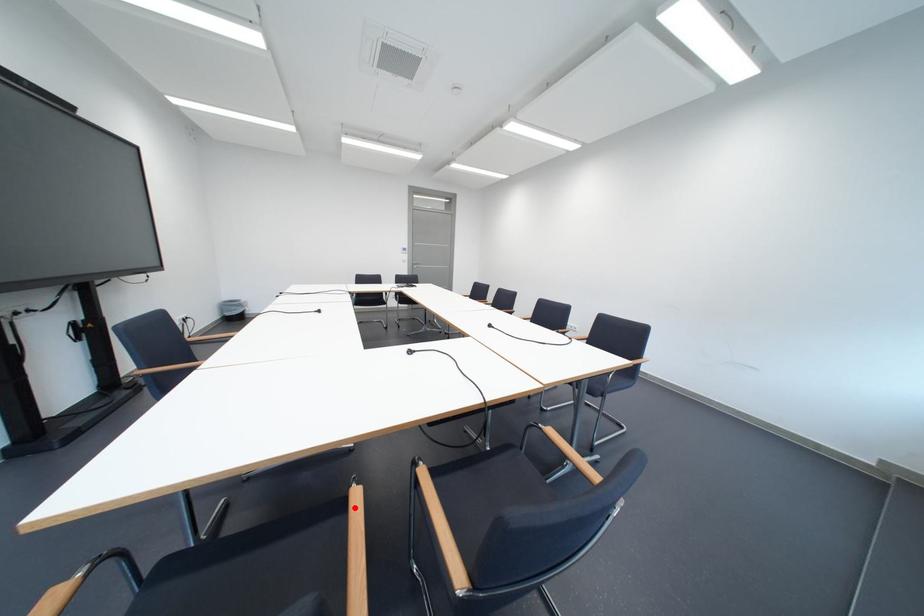
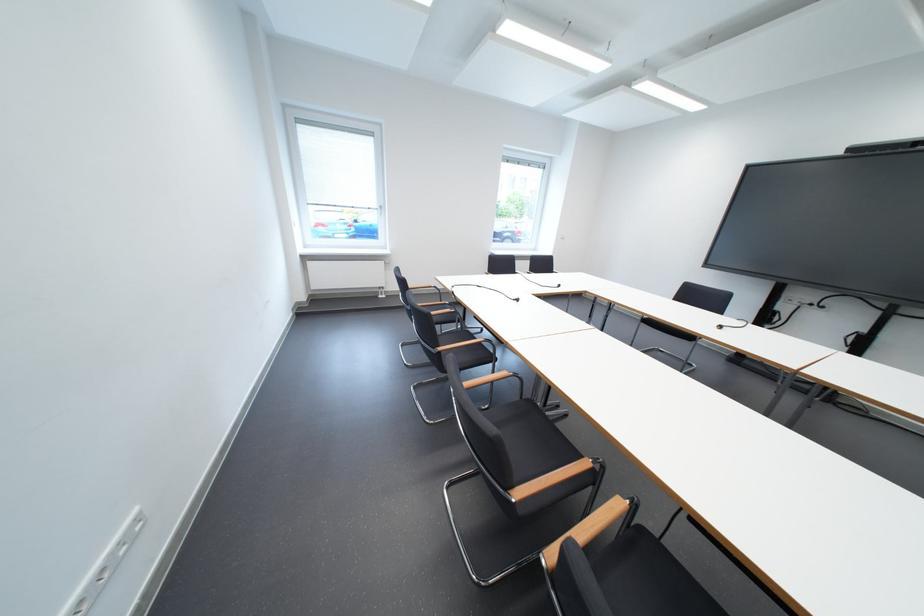
Question: I am providing you with two images of the same scene from different viewpoints. A red point is marked on the first image. Can you still see the location of the red point in image 2?

Choices:
 (A) Yes
 (B) No

Answer: (B)